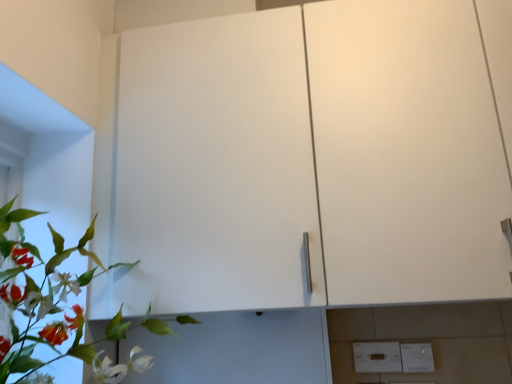
Identify the location of green leafy plant at left. The height and width of the screenshot is (384, 512). (52, 308).

What do you see at coordinates (52, 308) in the screenshot? The image size is (512, 384). I see `green leafy plant at left` at bounding box center [52, 308].

Measure the distance between point (x=64, y=321) and camera.

1.14 meters.

At what (x,y) coordinates should I click in order to perform the action: click on green leafy plant at left. Please return your answer as a coordinate pair (x, y). The image size is (512, 384). Looking at the image, I should click on (52, 308).